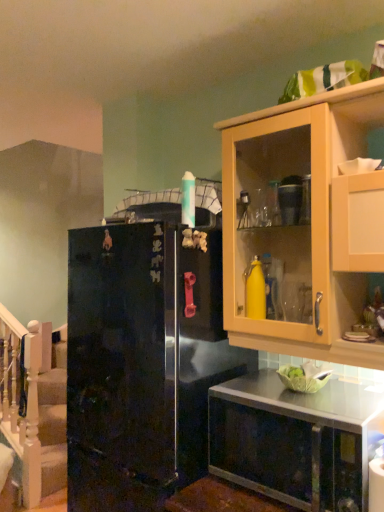
Question: Does point (327, 111) appear closer or farther from the camera than point (112, 371)?

Choices:
 (A) farther
 (B) closer

Answer: (B)

Question: Is light wood cabinet at upper right wider or thinner than glossy black refrigerator at left?

Choices:
 (A) wide
 (B) thin

Answer: (B)

Question: Estimate the real-world distances between objects in this image. Which object is closer to the metallic stainless steel microwave at lower right?

Choices:
 (A) white wooden staircase at left
 (B) glossy black refrigerator at left
 (C) light wood cabinet at upper right

Answer: (B)

Question: Which is nearer to the light wood cabinet at upper right?

Choices:
 (A) glossy black refrigerator at left
 (B) white wooden staircase at left
 (C) metallic stainless steel microwave at lower right

Answer: (A)